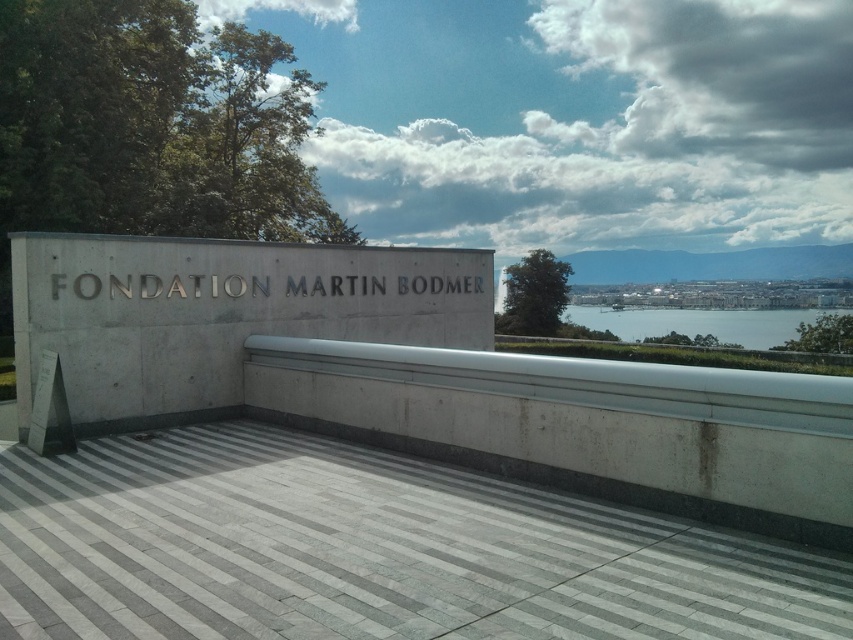
Question: Is white concrete sign at center further to the viewer compared to clear blue water at center?

Choices:
 (A) yes
 (B) no

Answer: (B)

Question: From the image, what is the correct spatial relationship of white concrete sign at center in relation to clear blue water at center?

Choices:
 (A) above
 (B) below

Answer: (B)

Question: Is white concrete sign at center bigger than clear blue water at center?

Choices:
 (A) no
 (B) yes

Answer: (A)

Question: Which of the following is the closest to the observer?

Choices:
 (A) (189, 262)
 (B) (769, 323)

Answer: (A)